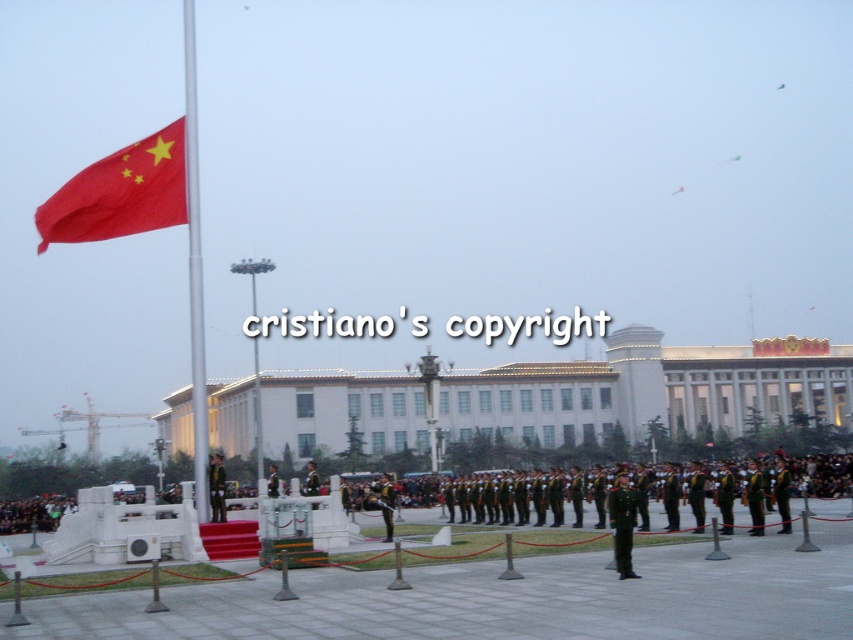
You are attending the event and want to take a photo of the camouflage uniform at center and green uniform at center. Which one is closer to the camera?

The camouflage uniform at center is closer to the camera because it is in front of the green uniform at center.

You are a photographer positioned at the back of the event area. You need to capture a photo of both the silver metallic flag pole at left and the camouflage uniform at center. Since you want to ensure both are fully visible in the frame, which object should you focus on first to avoid cropping either?

The silver metallic flag pole at left is taller than the camouflage uniform at center, so you should focus on the silver metallic flag pole at left first to ensure its full height is captured in the frame, avoiding cropping.

You are a guest at the event and want to take a photo of the camouflage uniform at center without any obstructions. Since the silver metallic flag pole at left is in the way, where should you move to get an unobstructed view?

The camouflage uniform at center is behind the silver metallic flag pole at left, so you should move to the right side of the flag pole to get an unobstructed view.